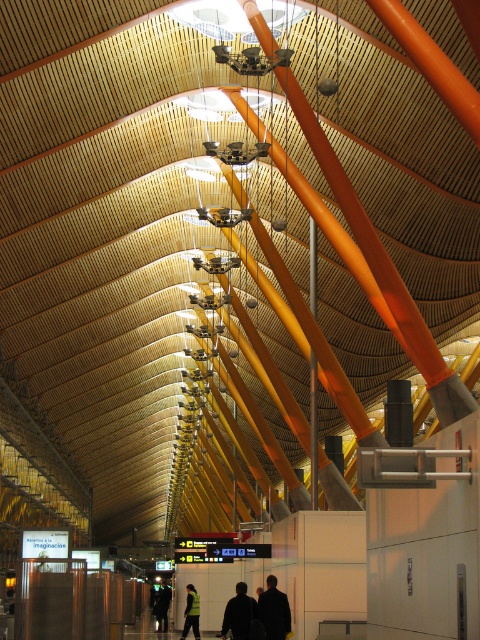
What do you see at coordinates (240, 612) in the screenshot? The height and width of the screenshot is (640, 480). I see `dark fabric jacket at center` at bounding box center [240, 612].

Can you confirm if dark fabric jacket at center is positioned above reflective yellow vest at center?

Yes.

Locate an element on the screen. This screenshot has height=640, width=480. dark fabric jacket at center is located at coordinates (240, 612).

Between point (276, 605) and point (240, 616), which one is positioned in front?

Positioned in front is point (276, 605).

Is point (259, 608) less distant than point (240, 609)?

Yes.

This screenshot has width=480, height=640. I want to click on dark brown leather jacket at center, so click(x=274, y=611).

Can you confirm if dark brown leather jacket at center is wider than dark green jacket at center?

No, dark brown leather jacket at center is not wider than dark green jacket at center.

Locate an element on the screen. The height and width of the screenshot is (640, 480). dark brown leather jacket at center is located at coordinates (274, 611).